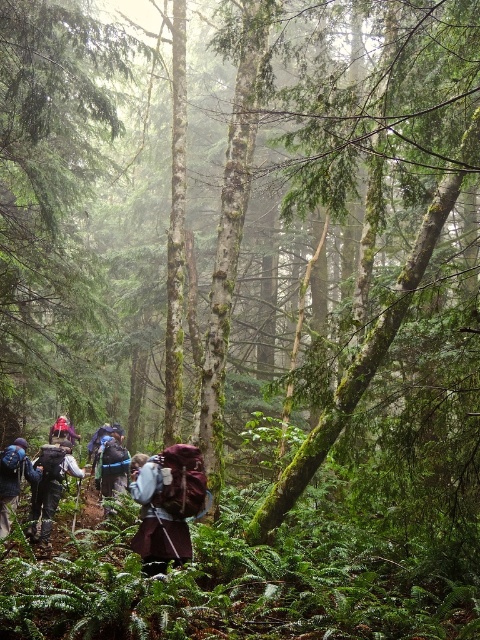
Question: Which point is closer to the camera?

Choices:
 (A) (60, 432)
 (B) (1, 532)
 (C) (78, 476)
 (D) (178, 499)

Answer: (D)

Question: Which of the following is the closest to the observer?

Choices:
 (A) (6, 456)
 (B) (168, 520)
 (C) (51, 492)
 (D) (69, 426)

Answer: (B)

Question: Is dark blue backpack at lower left thinner than blue fabric backpack at center?

Choices:
 (A) no
 (B) yes

Answer: (A)

Question: Does maroon fabric backpack at center come in front of dark blue backpack at lower left?

Choices:
 (A) yes
 (B) no

Answer: (A)

Question: Can you confirm if maroon fabric backpack at center is bigger than blue fabric backpack at center?

Choices:
 (A) yes
 (B) no

Answer: (B)

Question: Which object appears farthest from the camera in this image?

Choices:
 (A) camouflage fabric backpack at lower left
 (B) dark blue backpack at lower left
 (C) maroon fabric backpack at center
 (D) dark gray backpack at lower left

Answer: (A)